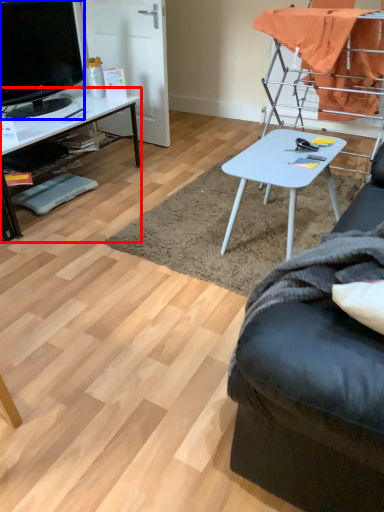
Question: Which of the following is the farthest to the observer, desk (highlighted by a red box) or television (highlighted by a blue box)?

Choices:
 (A) desk
 (B) television

Answer: (B)